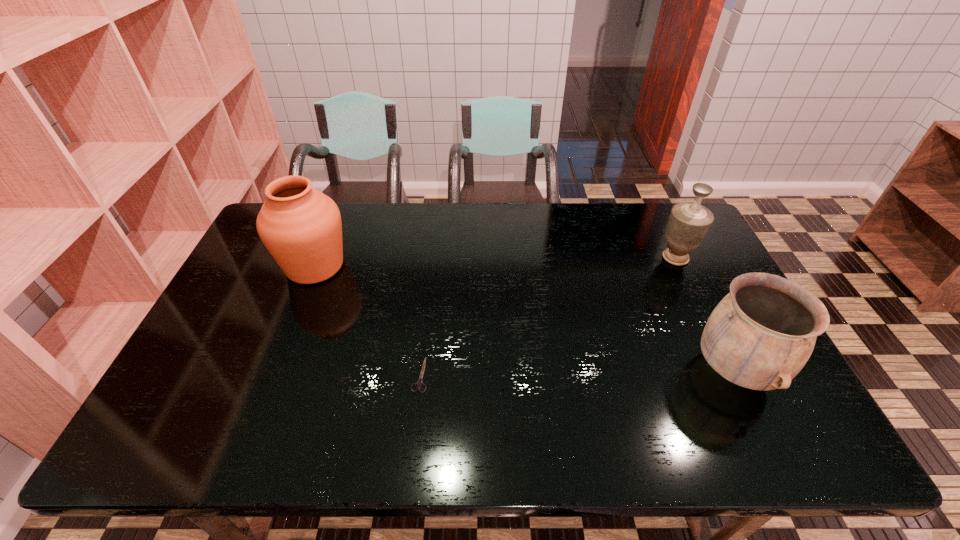
At what (x,y) coordinates should I click in order to perform the action: click on the leftmost object. Please return your answer as a coordinate pair (x, y). Looking at the image, I should click on (301, 227).

In order to click on the nearest urn in this screenshot , I will do `click(761, 334)`.

Where is `the shortest object`? the shortest object is located at coordinates (419, 383).

Image resolution: width=960 pixels, height=540 pixels. In order to click on shears in this screenshot , I will do `click(419, 383)`.

Find the location of a particular element. vacant space situated 0.280m on the front of the leftmost object is located at coordinates (274, 372).

You are a GUI agent. You are given a task and a screenshot of the screen. Output one action in this format:
    pyautogui.click(x=<x>, y=<y>)
    Task: Click on the vacant space situated 0.280m on the back of the nearest urn
    The width and height of the screenshot is (960, 540).
    Given the screenshot: What is the action you would take?
    pyautogui.click(x=683, y=264)

The width and height of the screenshot is (960, 540). Identify the location of free space located on the right of the shortest object. (451, 375).

This screenshot has height=540, width=960. What are the coordinates of `object that is at the far edge` in the screenshot? It's located at (301, 227).

Where is `object that is at the left edge`? object that is at the left edge is located at coordinates (301, 227).

Locate an element on the screen. This screenshot has width=960, height=540. object situated at the far left corner is located at coordinates (301, 227).